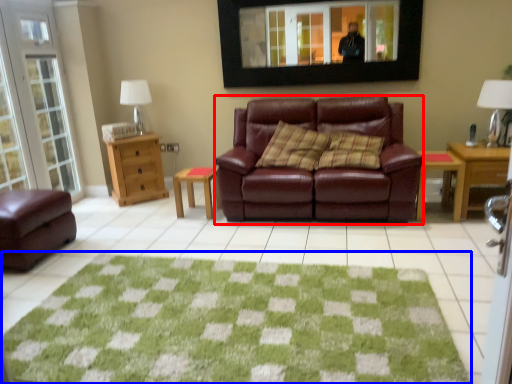
Question: Which object appears closest to the camera in this image, studio couch (highlighted by a red box) or doormat (highlighted by a blue box)?

Choices:
 (A) studio couch
 (B) doormat

Answer: (B)